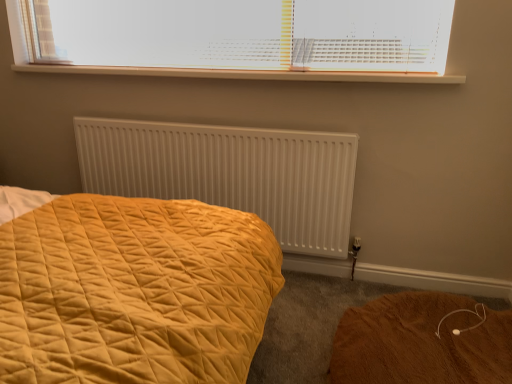
Identify the location of vacant region above white matte radiator at center (from a real-world perspective). The image size is (512, 384). (209, 117).